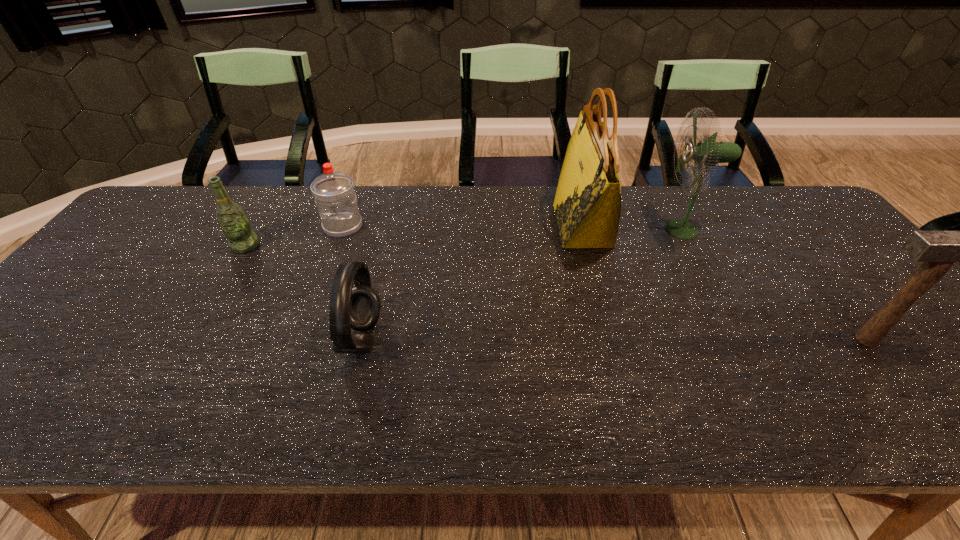
Find the location of a particular element. tote bag is located at coordinates (587, 204).

Find the location of a particular element. The image size is (960, 540). fan is located at coordinates (708, 152).

Where is `the rightmost object`? This screenshot has height=540, width=960. the rightmost object is located at coordinates (937, 250).

I want to click on mallet, so click(937, 250).

Where is `beer bottle`? The image size is (960, 540). beer bottle is located at coordinates (232, 219).

This screenshot has width=960, height=540. Identify the location of water bottle. (334, 194).

Find the location of a particular element. the fourth object from right to left is located at coordinates point(358,308).

Locate an element on the screen. Image resolution: width=960 pixels, height=540 pixels. free space located 0.210m on the front-facing side of the tote bag is located at coordinates (487, 225).

The width and height of the screenshot is (960, 540). Find the location of `vacant region located 0.390m on the front-facing side of the tote bag`. vacant region located 0.390m on the front-facing side of the tote bag is located at coordinates (427, 225).

Locate an element on the screen. vacant space located on the front-facing side of the tote bag is located at coordinates (531, 225).